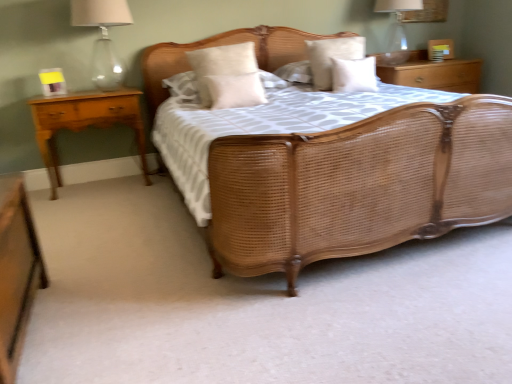
The height and width of the screenshot is (384, 512). Identify the location of vacant space in front of light brown wood nightstand at left, the third nightstand viewed from the right. (112, 204).